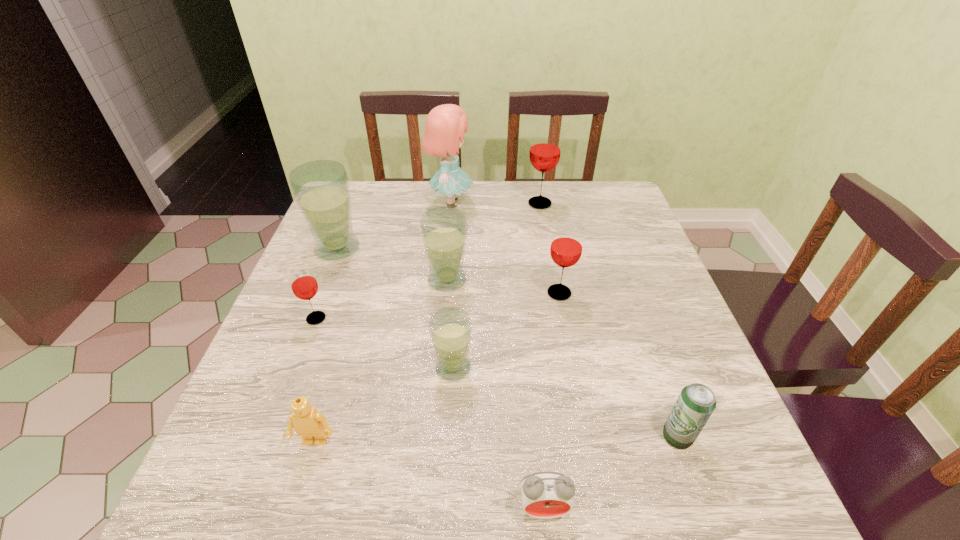
At what (x,y) coordinates should I click in order to perform the action: click on doll. Please return your answer as a coordinate pair (x, y). Looking at the image, I should click on (445, 125).

Where is `blue doll`? Image resolution: width=960 pixels, height=540 pixels. blue doll is located at coordinates (445, 125).

Identify the location of the farthest red glass. This screenshot has width=960, height=540. (545, 148).

Identify the location of the farthest glass. The height and width of the screenshot is (540, 960). click(545, 148).

Identify the location of the second farthest glass. point(321,188).

Find the location of a particular element. the biggest blue glass is located at coordinates (321, 188).

You are a GUI agent. You are given a task and a screenshot of the screen. Output one action in this format:
    pyautogui.click(x=<x>, y=<y>)
    Task: Click on the second nearest red glass
    Image resolution: width=960 pixels, height=540 pixels.
    Given the screenshot: What is the action you would take?
    pyautogui.click(x=566, y=248)

This screenshot has width=960, height=540. What are the coordinates of `the second nearest blue glass` in the screenshot? It's located at (443, 229).

Where is `the nearest red glass`? This screenshot has width=960, height=540. the nearest red glass is located at coordinates (304, 285).

You are a GUI agent. You are given a task and a screenshot of the screen. Output one action in this format:
    pyautogui.click(x=<x>, y=<y>)
    Task: Click on the smallest red glass
    The image size is (960, 540).
    Given the screenshot: What is the action you would take?
    pyautogui.click(x=304, y=285)